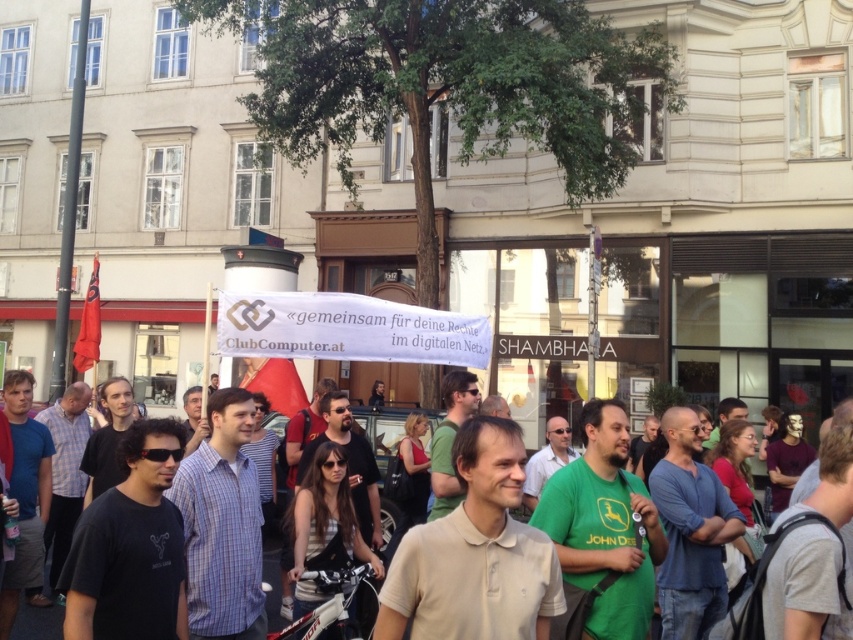
Is white fabric banner at center behind light beige polo shirt at center?

That is True.

Identify the location of white fabric banner at center. This screenshot has height=640, width=853. (347, 330).

Identify the location of white fabric banner at center. The height and width of the screenshot is (640, 853). (347, 330).